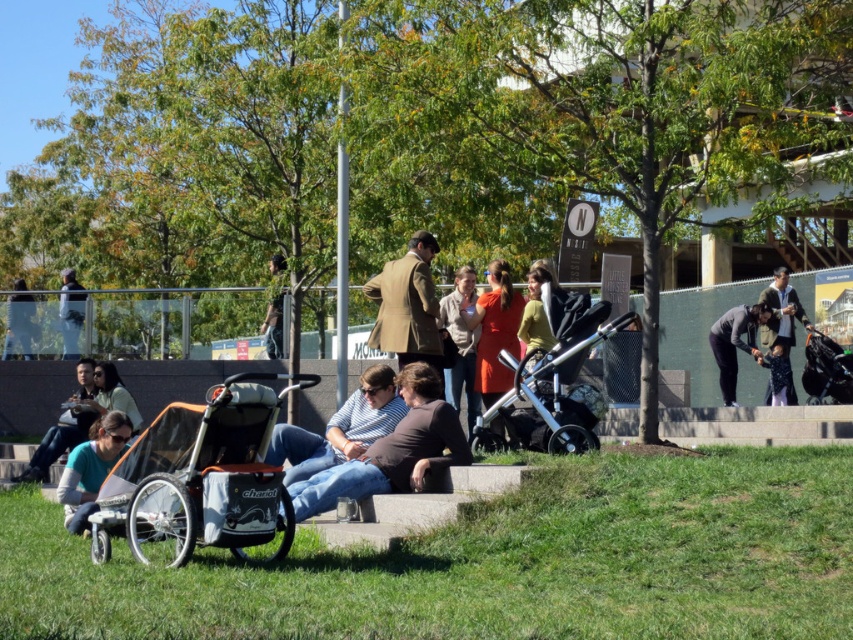
Does green grass at lower left have a greater height compared to denim jeans at center?

No.

Is point (756, 486) more distant than point (409, 406)?

No.

Find the location of a particular element. green grass at lower left is located at coordinates (492, 563).

Locate an element on the screen. green grass at lower left is located at coordinates (492, 563).

Who is more forward, (251, 424) or (399, 468)?

Point (251, 424) is more forward.

Identify the location of orange fabric stroller at lower left. The height and width of the screenshot is (640, 853). (201, 477).

In order to click on orange fabric stroller at lower left in this screenshot , I will do `click(201, 477)`.

Does orange fabric stroller at lower left have a smaller size compared to dark gray jacket at upper right?

No.

In the scene shown: Between orange fabric stroller at lower left and dark gray jacket at upper right, which one appears on the right side from the viewer's perspective?

dark gray jacket at upper right

Which is behind, point (177, 486) or point (793, 323)?

The point (793, 323) is more distant.

Identify the location of orange fabric stroller at lower left. (201, 477).